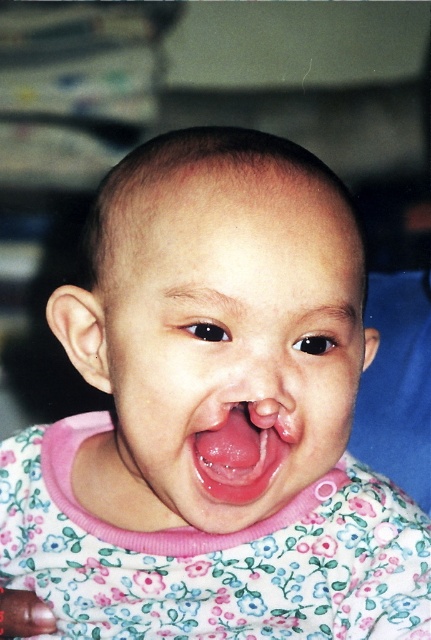
Based on the scene description, where is the pink fabric face at center located in terms of coordinates?

The pink fabric face at center is located at coordinates point (230, 356).

You are a photographer trying to capture a closeup of the child in the image. The camera is positioned at a certain distance from the point of interest at point (350, 337). If you want to adjust the camera to be exactly 30 centimeters away from the point of interest, should you move the camera closer or farther away?

The camera is currently 36.79 centimeters away from point (350, 337). To reach 30 centimeters, you should move the camera closer to the point of interest.